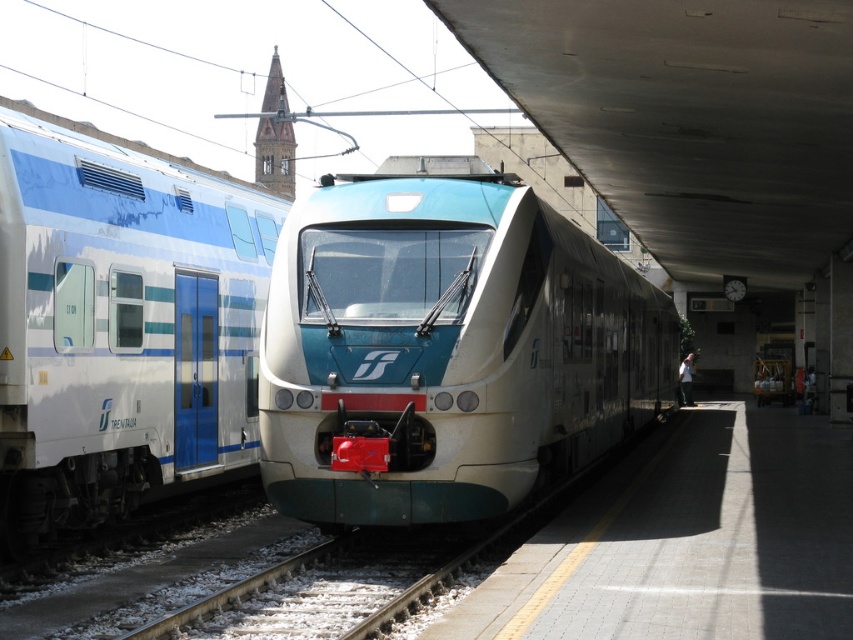
Question: Which object is closer to the camera taking this photo?

Choices:
 (A) white gravel at lower center
 (B) matte white train at center

Answer: (A)

Question: Can you confirm if matte white train at center is wider than white glossy train car at left?

Choices:
 (A) yes
 (B) no

Answer: (A)

Question: Which object appears closest to the camera in this image?

Choices:
 (A) matte white train at center
 (B) white glossy train car at left
 (C) white gravel at lower center
 (D) white tile platform at center

Answer: (D)

Question: Does matte white train at center have a smaller size compared to white gravel at lower center?

Choices:
 (A) no
 (B) yes

Answer: (A)

Question: Does white glossy train car at left appear on the right side of white tile platform at center?

Choices:
 (A) no
 (B) yes

Answer: (A)

Question: Which of the following is the closest to the observer?

Choices:
 (A) (351, 499)
 (B) (268, 256)
 (C) (659, 497)
 (D) (326, 616)

Answer: (D)